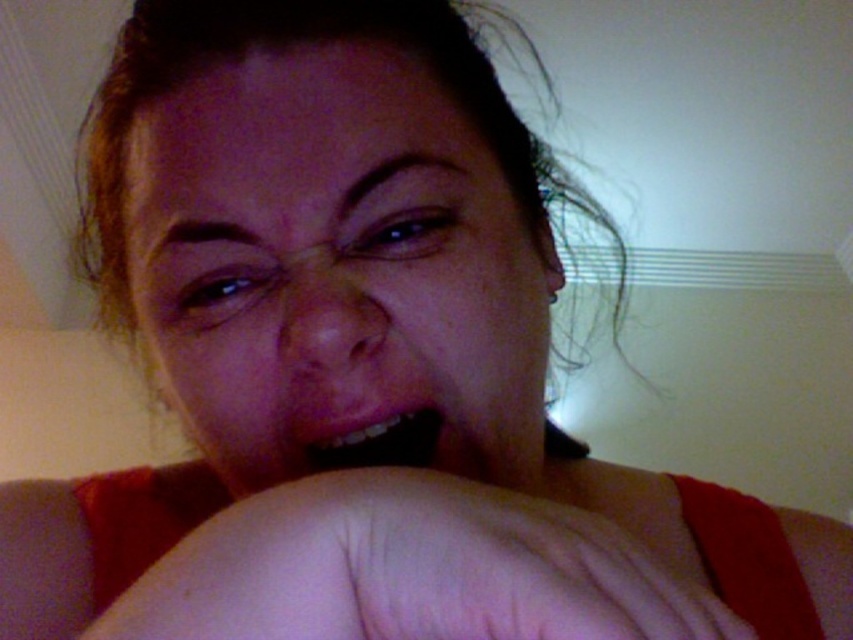
Question: Is smooth skin at center wider than pink matte lips at center?

Choices:
 (A) no
 (B) yes

Answer: (B)

Question: Is smooth skin at center to the right of pink matte lips at center from the viewer's perspective?

Choices:
 (A) yes
 (B) no

Answer: (A)

Question: Does smooth skin at center appear over pink matte lips at center?

Choices:
 (A) no
 (B) yes

Answer: (A)